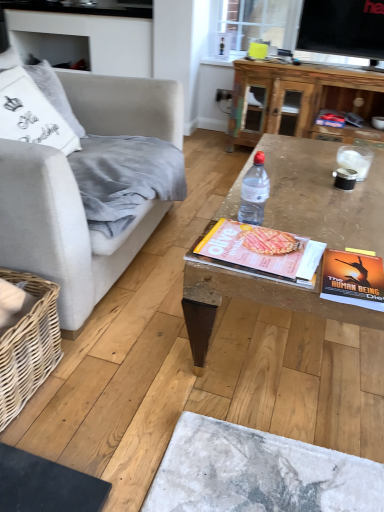
The image size is (384, 512). In order to click on free space behind matte yellow magazine at center in this screenshot , I will do `click(288, 214)`.